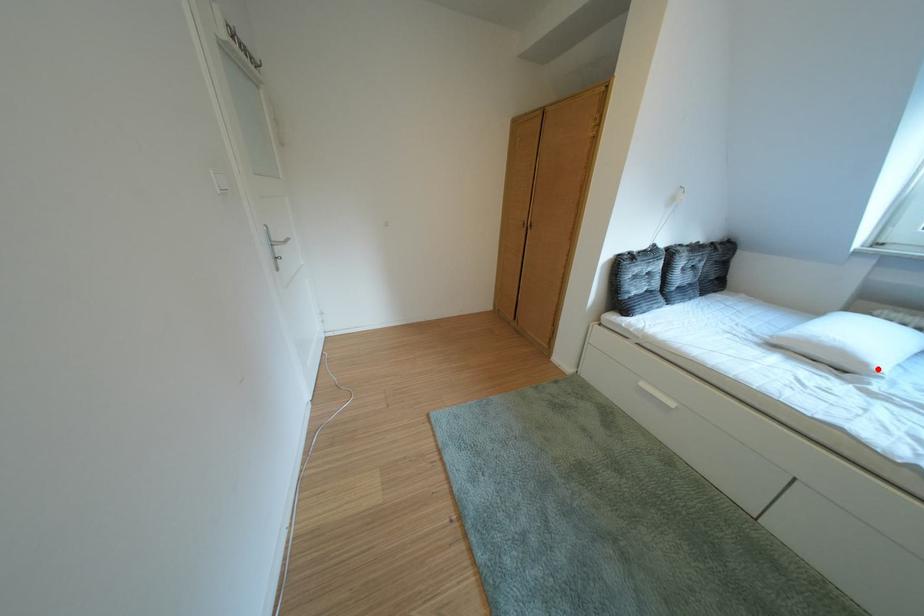
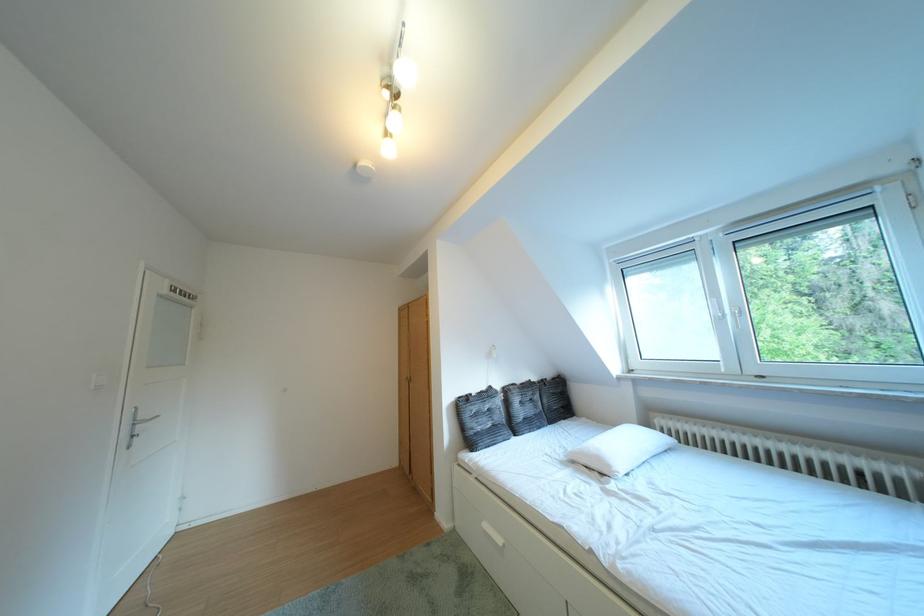
In the second image, find the point that corresponds to the highlighted location in the first image.

(623, 471)